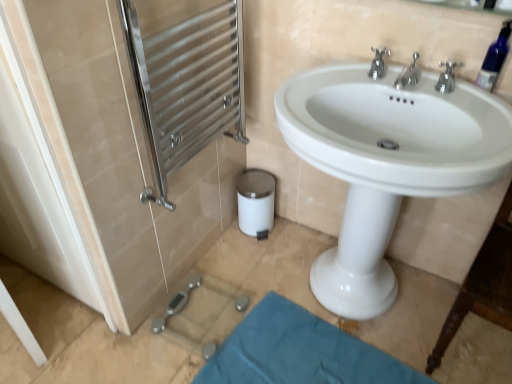
Question: Can you confirm if teal fabric bath mat at lower center is bigger than white glossy sink at center?

Choices:
 (A) yes
 (B) no

Answer: (B)

Question: Does teal fabric bath mat at lower center appear on the right side of white glossy sink at center?

Choices:
 (A) yes
 (B) no

Answer: (B)

Question: Are teal fabric bath mat at lower center and white glossy sink at center making contact?

Choices:
 (A) yes
 (B) no

Answer: (B)

Question: From the image's perspective, is teal fabric bath mat at lower center over white glossy sink at center?

Choices:
 (A) no
 (B) yes

Answer: (A)

Question: Is teal fabric bath mat at lower center wider than white glossy sink at center?

Choices:
 (A) no
 (B) yes

Answer: (A)

Question: Could white glossy sink at center be considered to be inside teal fabric bath mat at lower center?

Choices:
 (A) yes
 (B) no

Answer: (B)

Question: Could you tell me if polished stainless steel towel rack at left, the first screen door when ordered from right to left, is turned towards white glossy screen door at left, which ranks as the first screen door in left-to-right order?

Choices:
 (A) no
 (B) yes

Answer: (A)

Question: Does polished stainless steel towel rack at left, the first screen door when ordered from right to left, appear on the left side of white glossy screen door at left, the 2th screen door when ordered from right to left?

Choices:
 (A) no
 (B) yes

Answer: (A)

Question: Can you confirm if polished stainless steel towel rack at left, the 2th screen door in the left-to-right sequence, is smaller than white glossy screen door at left, which ranks as the first screen door in left-to-right order?

Choices:
 (A) yes
 (B) no

Answer: (B)

Question: Are polished stainless steel towel rack at left, the first screen door when ordered from right to left, and white glossy screen door at left, which ranks as the first screen door in left-to-right order, located far from each other?

Choices:
 (A) yes
 (B) no

Answer: (B)

Question: Is white glossy screen door at left, which ranks as the first screen door in left-to-right order, a part of polished stainless steel towel rack at left, the 2th screen door in the left-to-right sequence?

Choices:
 (A) yes
 (B) no

Answer: (B)

Question: Is polished stainless steel towel rack at left, the first screen door when ordered from right to left, positioned with its back to white glossy screen door at left, which ranks as the first screen door in left-to-right order?

Choices:
 (A) no
 (B) yes

Answer: (B)

Question: Can we say polished chrome faucet at upper center, which appears as the 2th tap when viewed from the right, lies outside teal fabric bath mat at lower center?

Choices:
 (A) yes
 (B) no

Answer: (A)